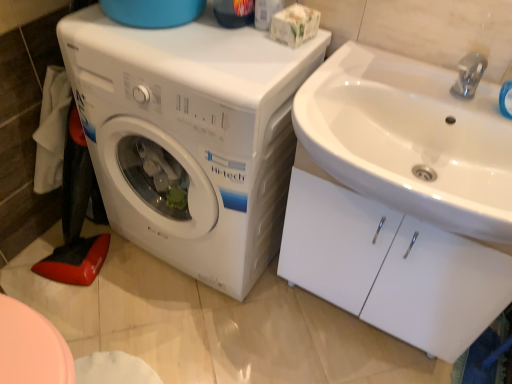
I want to click on white plastic washing machine at left, so click(x=190, y=137).

Is white plastic washing machine at left at the back of white glossy sink at upper right?

No, white plastic washing machine at left is not at the back of white glossy sink at upper right.

Based on the photo, between white glossy sink at upper right and white plastic washing machine at left, which one has more height?

white plastic washing machine at left is taller.

Is there a large distance between white glossy sink at upper right and white plastic washing machine at left?

They are positioned close to each other.

From a real-world perspective, who is located lower, white glossy sink at upper right or white plastic washing machine at left?

From a 3D spatial view, white glossy sink at upper right is below.

Which of these two, white glossy sink at upper right or white plastic washing machine at left, stands shorter?

With less height is white glossy sink at upper right.

From a real-world perspective, is white glossy sink at upper right positioned above or below white plastic washing machine at left?

From a real-world perspective, white glossy sink at upper right is physically above white plastic washing machine at left.

Which of these two, white glossy sink at upper right or white plastic washing machine at left, is wider?

Wider between the two is white glossy sink at upper right.

Find the location of a particular element. This screenshot has height=384, width=512. washing machine that is under the white glossy sink at upper right (from a real-world perspective) is located at coordinates (190, 137).

How different are the orientations of white glossy sink at upper right and white glossy sink at upper right in degrees?

There is a 0.214-degree angle between the facing directions of white glossy sink at upper right and white glossy sink at upper right.

Looking at this image, could white glossy sink at upper right be considered to be inside white glossy sink at upper right?

No, white glossy sink at upper right is not a part of white glossy sink at upper right.

Does point (425, 78) appear closer or farther from the camera than point (380, 300)?

Point (425, 78) appears to be closer to the viewer than point (380, 300).

Can you confirm if white glossy sink at upper right is smaller than white glossy sink at upper right?

Correct, white glossy sink at upper right occupies less space than white glossy sink at upper right.

Does white glossy sink at upper right have a lesser width compared to white glossy sink at upper right?

Yes, white glossy sink at upper right is thinner than white glossy sink at upper right.

Consider the image. Considering the relative sizes of white glossy sink at upper right and white glossy sink at upper right in the image provided, is white glossy sink at upper right bigger than white glossy sink at upper right?

Indeed, white glossy sink at upper right has a larger size compared to white glossy sink at upper right.

Is white glossy sink at upper right shorter than white glossy sink at upper right?

No.

How far apart are white glossy sink at upper right and white glossy sink at upper right?

They are 25.08 centimeters apart.

Is white plastic washing machine at left touching white glossy sink at upper right?

white plastic washing machine at left and white glossy sink at upper right are not in contact.

Based on the photo, which point is more forward, (196,194) or (390,168)?

Positioned in front is point (390,168).

Which object is more forward, white plastic washing machine at left or white glossy sink at upper right?

white glossy sink at upper right is in front.

From a real-world perspective, which is physically above, white plastic washing machine at left or white glossy sink at upper right?

white glossy sink at upper right.

Are white plastic washing machine at left and white glossy sink at upper right making contact?

No, white plastic washing machine at left is not touching white glossy sink at upper right.

Identify the location of drawer in front of the white plastic washing machine at left. This screenshot has height=384, width=512. (391, 267).

From the image's perspective, is white plastic washing machine at left positioned above or below white glossy sink at upper right?

Clearly, from the image's perspective, white plastic washing machine at left is above white glossy sink at upper right.

Between white plastic washing machine at left and white glossy sink at upper right, which one has larger size?

Bigger between the two is white plastic washing machine at left.

Locate an element on the screen. The height and width of the screenshot is (384, 512). washing machine located above the white glossy sink at upper right (from the image's perspective) is located at coordinates (190, 137).

Locate an element on the screen. sink that appears on the right of white plastic washing machine at left is located at coordinates (410, 139).

Looking at the image, which one is located closer to white plastic washing machine at left, white glossy sink at upper right or white glossy sink at upper right?

white glossy sink at upper right is closer to white plastic washing machine at left.

Considering their positions, is white glossy sink at upper right positioned further to white glossy sink at upper right than white plastic washing machine at left?

white plastic washing machine at left is positioned further to the anchor white glossy sink at upper right.

Based on their spatial positions, is white plastic washing machine at left or white glossy sink at upper right closer to white glossy sink at upper right?

The object closer to white glossy sink at upper right is white glossy sink at upper right.

Which object lies further to the anchor point white glossy sink at upper right, white plastic washing machine at left or white glossy sink at upper right?

Based on the image, white plastic washing machine at left appears to be further to white glossy sink at upper right.

From the image, which object appears to be farther from white glossy sink at upper right, white glossy sink at upper right or white plastic washing machine at left?

white plastic washing machine at left lies further to white glossy sink at upper right than the other object.

Considering their positions, is white glossy sink at upper right positioned further to white plastic washing machine at left than white glossy sink at upper right?

Based on the image, white glossy sink at upper right appears to be further to white plastic washing machine at left.

This screenshot has width=512, height=384. Find the location of `sink between white plastic washing machine at left and white glossy sink at upper right from left to right`. sink between white plastic washing machine at left and white glossy sink at upper right from left to right is located at coordinates (410, 139).